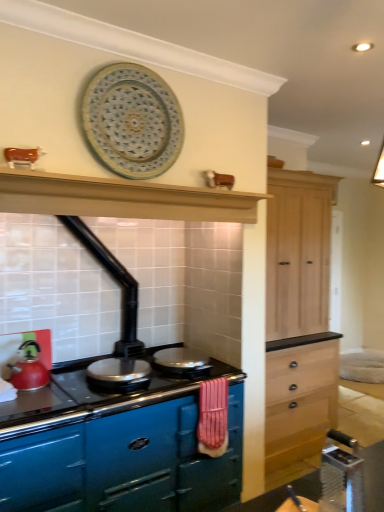
You are a GUI agent. You are given a task and a screenshot of the screen. Output one action in this format:
    pyautogui.click(x=<x>, y=<y>)
    Task: Click on the free location in front of shiny metallic pan at center, which is the 2th appliance in right-to-left order
    The image size is (384, 512).
    Given the screenshot: What is the action you would take?
    pyautogui.click(x=101, y=400)